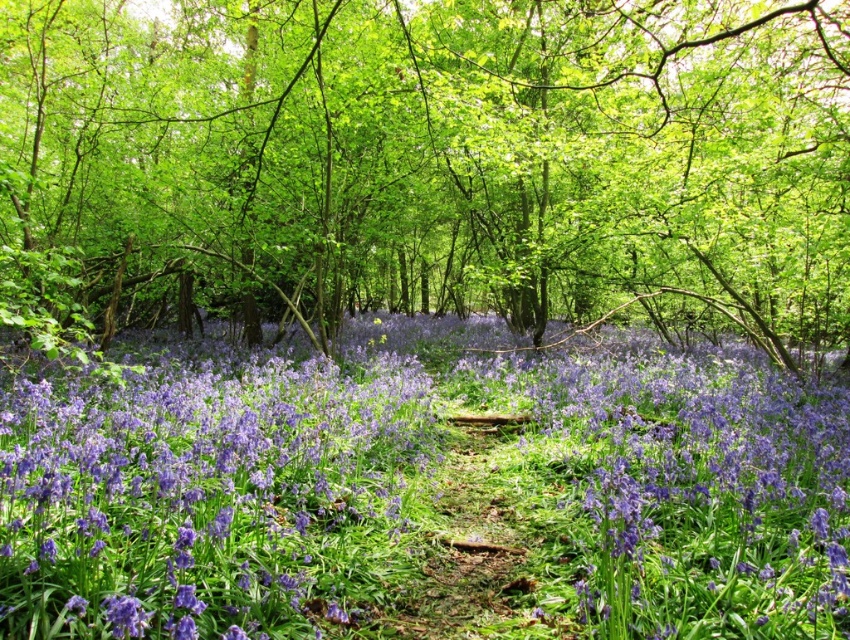
You are a hiker who wants to take a photo of the purple matte flower at center without the green leafy tree at center blocking the view. Is there a way to do this by moving forward or backward along the path?

The green leafy tree at center is in front of the purple matte flower at center, so moving forward along the path might bring the tree closer, but moving backward could create distance between them. However, since the tree is already blocking the flower, you might need to move sideways off the path to get an unobstructed view.

You are a hiker carrying a 15 feet long ladder. You need to place it between the green leafy tree at center and the purple matte flower at center. Can the ladder fit between them without bending?

The distance between the green leafy tree at center and the purple matte flower at center is 16.35 feet. Since the ladder is 15 feet long, it can fit between them without bending as there is enough space.